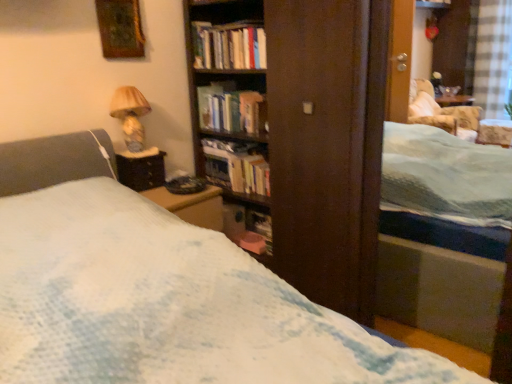
Question: Does point (96, 4) appear closer or farther from the camera than point (117, 104)?

Choices:
 (A) closer
 (B) farther

Answer: (A)

Question: Is gold textured frame at upper left wider or thinner than matte beige lampshade at upper left?

Choices:
 (A) thin
 (B) wide

Answer: (A)

Question: Which is nearer to the gold textured frame at upper left?

Choices:
 (A) hardcover books at center, which appears as the 2th book when viewed from the top
 (B) matte beige lampshade at upper left
 (C) hardcover book at center, which ranks as the third book in top-to-bottom order
 (D) wooden table at left
 (E) hardcover books at center, which is counted as the first book, starting from the top

Answer: (B)

Question: Considering the real-world distances, which object is farthest from the wooden table at left?

Choices:
 (A) hardcover books at center, which is counted as the first book, starting from the top
 (B) gold textured frame at upper left
 (C) hardcover book at center, which is the first book from bottom to top
 (D) matte beige lampshade at upper left
 (E) hardcover books at center, which appears as the 2th book when viewed from the top

Answer: (A)